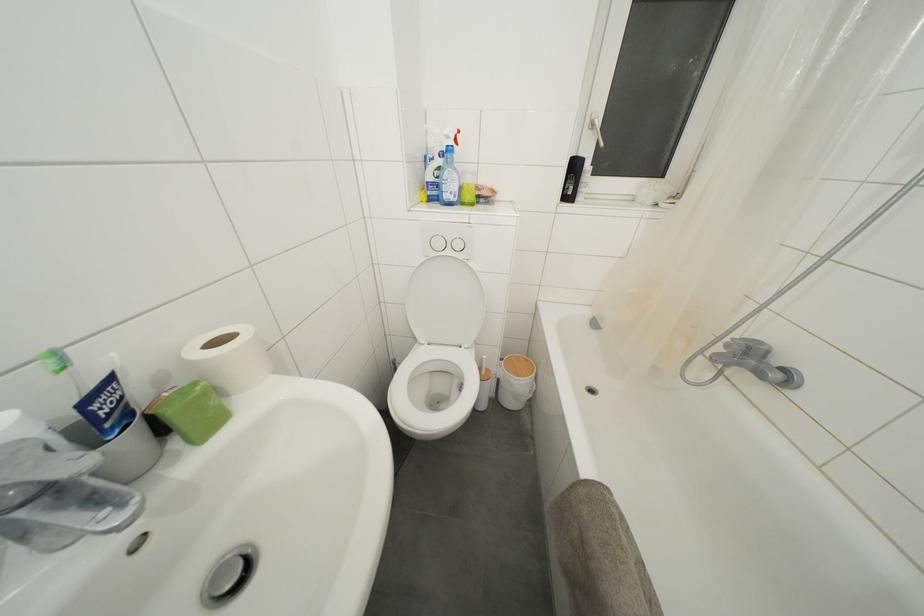
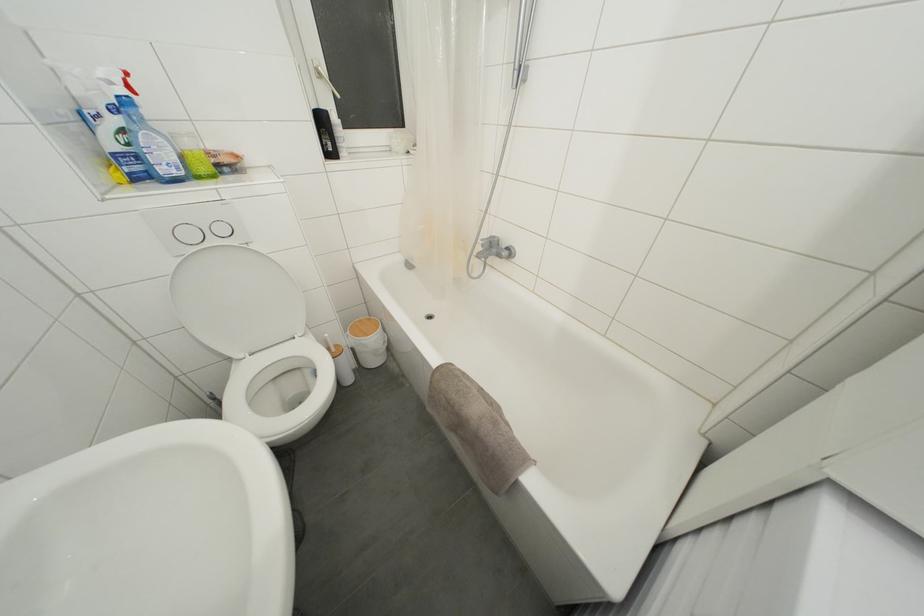
In the second image, find the point that corresponds to point (472, 185) in the first image.

(193, 148)